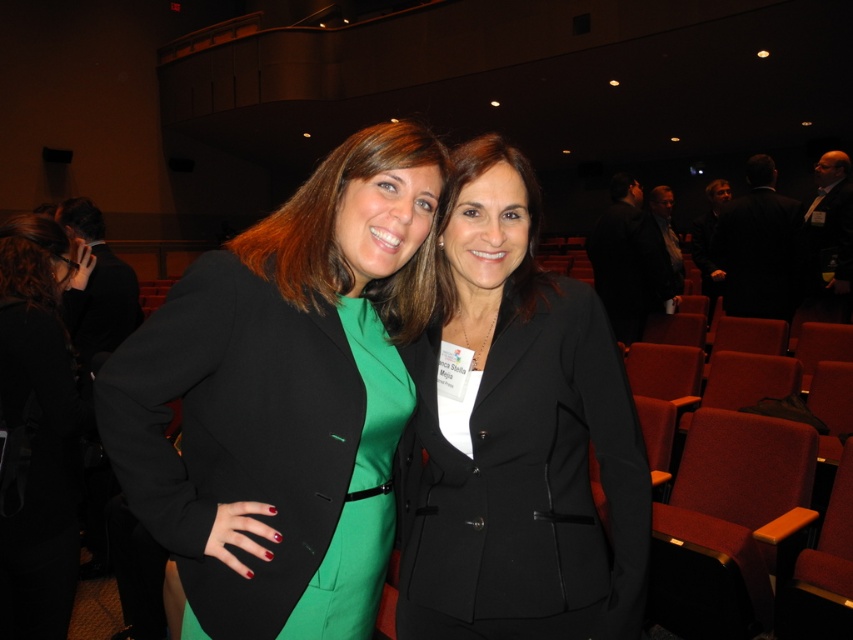
Question: Among these points, which one is nearest to the camera?

Choices:
 (A) (39, 561)
 (B) (537, 468)

Answer: (B)

Question: Which point is closer to the camera?

Choices:
 (A) matte black blazer at center
 (B) green satin dress at center
 (C) black matte suit at center

Answer: (A)

Question: Is matte black blazer at center below black smooth suit at right?

Choices:
 (A) no
 (B) yes

Answer: (B)

Question: Which object appears farthest from the camera in this image?

Choices:
 (A) matte black blazer at center
 (B) black smooth suit at right
 (C) green matte blazer at left
 (D) black matte suit at center

Answer: (D)

Question: Does green matte blazer at left appear on the right side of black matte blazer at left?

Choices:
 (A) no
 (B) yes

Answer: (B)

Question: Is black matte blazer at center wider than black smooth suit at right?

Choices:
 (A) yes
 (B) no

Answer: (B)